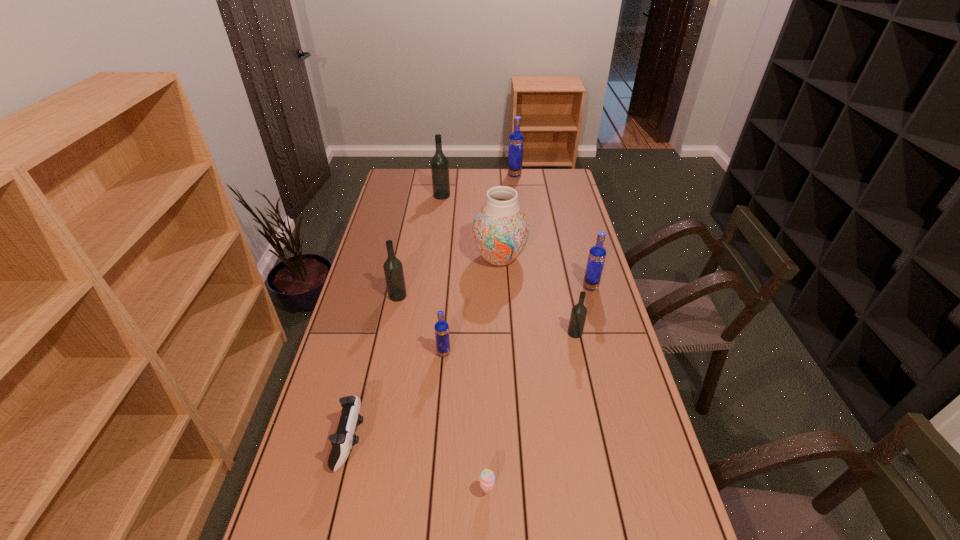
Image resolution: width=960 pixels, height=540 pixels. Find the location of `vacant area that lies between the farthest vodka and the rightmost black vodka`. vacant area that lies between the farthest vodka and the rightmost black vodka is located at coordinates (544, 254).

The image size is (960, 540). Identify the location of empty location between the farthest object and the eighth farthest object. (433, 308).

Where is `free spot between the sixth farthest object and the second nearest black vodka`? free spot between the sixth farthest object and the second nearest black vodka is located at coordinates [x=487, y=314].

The width and height of the screenshot is (960, 540). What are the coordinates of `empty location between the second black vodka from left to right and the second nearest object` in the screenshot? It's located at (396, 318).

Identify the location of vacant region between the second farthest black vodka and the shortest object. The height and width of the screenshot is (540, 960). (443, 393).

Identify which object is located as the fourth nearest to the nearest blue vodka. Please provide its 2D coordinates. Your answer should be formatted as a tuple, i.e. [(x, y)], where the tuple contains the x and y coordinates of a point satisfying the conditions above.

[(579, 312)]

Where is `object that is the eighth closest to the second smallest blue vodka`? The width and height of the screenshot is (960, 540). object that is the eighth closest to the second smallest blue vodka is located at coordinates (344, 439).

Locate an element on the screen. The image size is (960, 540). the third closest vodka relative to the leftmost blue vodka is located at coordinates (597, 254).

Identify which vodka is located as the nearest to the third farthest object. Please provide its 2D coordinates. Your answer should be formatted as a tuple, i.e. [(x, y)], where the tuple contains the x and y coordinates of a point satisfying the conditions above.

[(597, 254)]

This screenshot has width=960, height=540. What are the coordinates of `blue vodka object that ranks as the third closest to the seventh nearest object` in the screenshot? It's located at (516, 139).